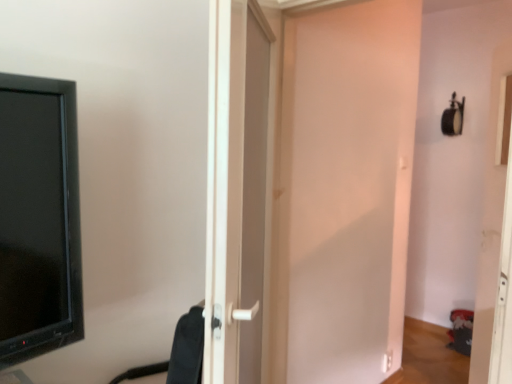
Question: Does white matte door at center, marked as the 1th door in a right-to-left arrangement, have a greater width compared to white plastic door at center, which is the 1th door in left-to-right order?

Choices:
 (A) yes
 (B) no

Answer: (B)

Question: Does white matte door at center, the second door positioned from the left, contain white plastic door at center, which appears as the second door when viewed from the right?

Choices:
 (A) no
 (B) yes

Answer: (A)

Question: Is white matte door at center, marked as the 1th door in a right-to-left arrangement, further to the viewer compared to white plastic door at center, which appears as the second door when viewed from the right?

Choices:
 (A) no
 (B) yes

Answer: (B)

Question: Does white matte door at center, the second door positioned from the left, appear on the right side of white plastic door at center, which is the 1th door in left-to-right order?

Choices:
 (A) no
 (B) yes

Answer: (B)

Question: From the image's perspective, is white matte door at center, marked as the 1th door in a right-to-left arrangement, on white plastic door at center, which is the 1th door in left-to-right order?

Choices:
 (A) no
 (B) yes

Answer: (B)

Question: In terms of width, does white matte door at center, marked as the 1th door in a right-to-left arrangement, look wider or thinner when compared to white plastic door at center, which is the 1th door in left-to-right order?

Choices:
 (A) wide
 (B) thin

Answer: (B)

Question: Based on their sizes in the image, would you say white matte door at center, the second door positioned from the left, is bigger or smaller than white plastic door at center, which is the 1th door in left-to-right order?

Choices:
 (A) big
 (B) small

Answer: (B)

Question: Relative to white plastic door at center, which is the 1th door in left-to-right order, is white matte door at center, the second door positioned from the left, in front or behind?

Choices:
 (A) behind
 (B) front

Answer: (A)

Question: Is white matte door at center, marked as the 1th door in a right-to-left arrangement, inside or outside of white plastic door at center, which is the 1th door in left-to-right order?

Choices:
 (A) inside
 (B) outside

Answer: (B)

Question: From the image's perspective, is white plastic door at center, which appears as the second door when viewed from the right, positioned above or below black fabric swivel chair at center?

Choices:
 (A) above
 (B) below

Answer: (A)

Question: Is white plastic door at center, which appears as the second door when viewed from the right, taller or shorter than black fabric swivel chair at center?

Choices:
 (A) short
 (B) tall

Answer: (B)

Question: From a real-world perspective, is white plastic door at center, which appears as the second door when viewed from the right, physically located above or below black fabric swivel chair at center?

Choices:
 (A) below
 (B) above

Answer: (B)

Question: In the image, is white plastic door at center, which is the 1th door in left-to-right order, positioned in front of or behind black fabric swivel chair at center?

Choices:
 (A) behind
 (B) front

Answer: (B)

Question: In terms of width, does black fabric swivel chair at center look wider or thinner when compared to white plastic door at center, which appears as the second door when viewed from the right?

Choices:
 (A) thin
 (B) wide

Answer: (A)

Question: Which is correct: black fabric swivel chair at center is inside white plastic door at center, which appears as the second door when viewed from the right, or outside of it?

Choices:
 (A) outside
 (B) inside

Answer: (B)